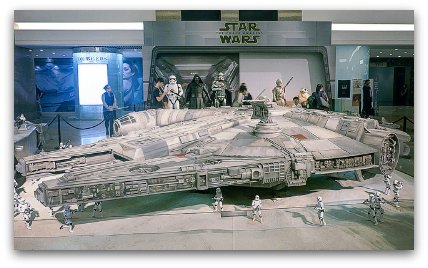
Locate an element on the screen. This screenshot has width=428, height=268. door is located at coordinates (303, 64).